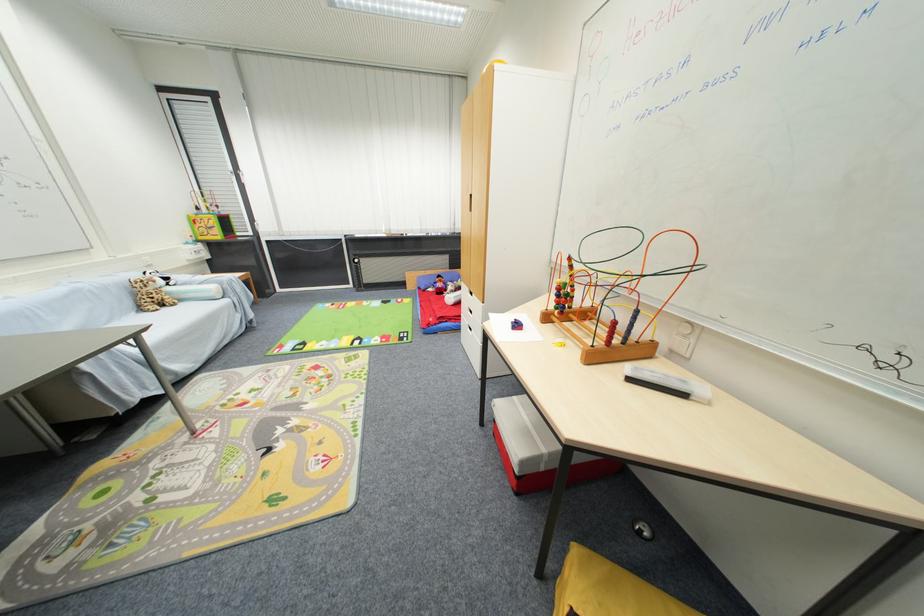
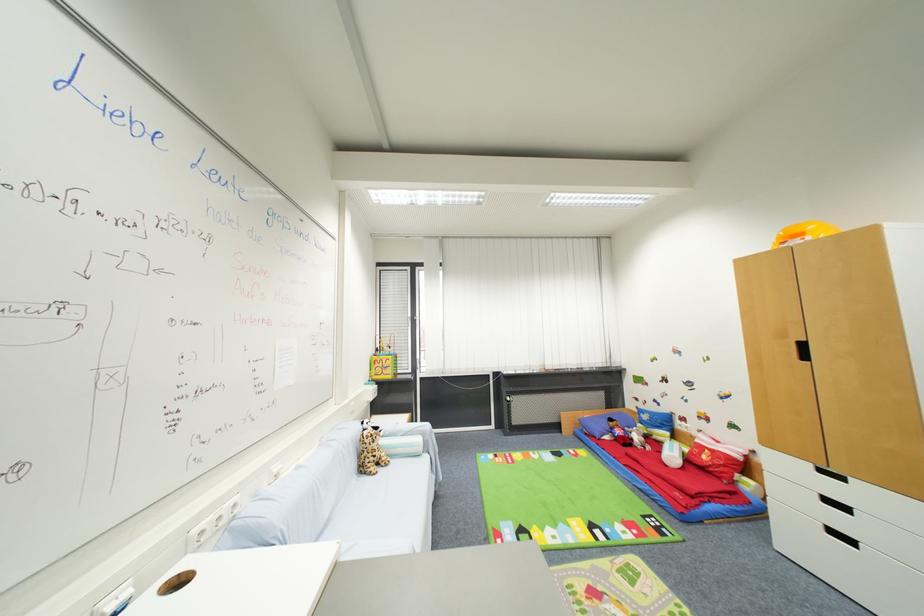
In the second image, find the point that corresponds to (171,310) in the first image.

(385, 472)